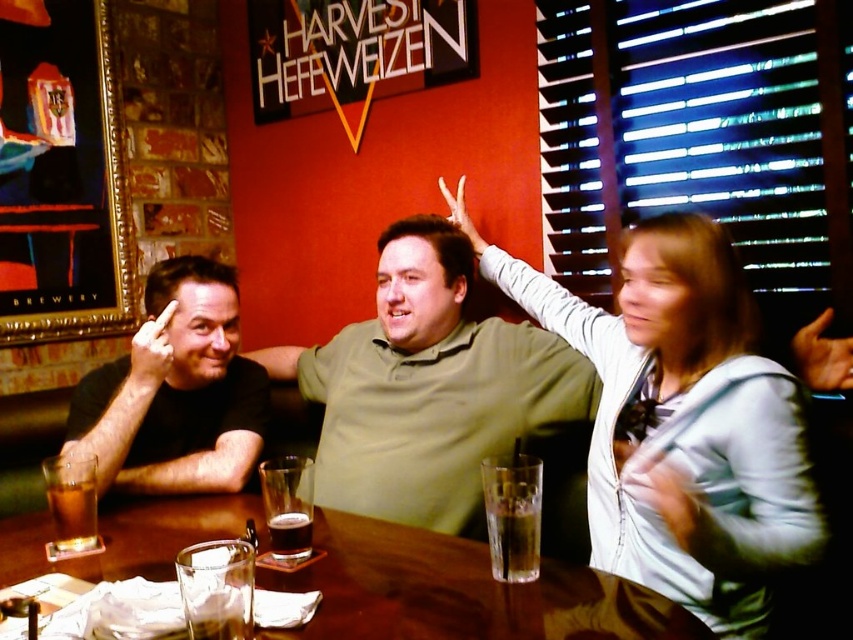
Question: Among these points, which one is nearest to the camera?

Choices:
 (A) (274, 547)
 (B) (311, 467)
 (C) (462, 177)

Answer: (A)

Question: Estimate the real-world distances between objects in this image. Which object is farther from the dark brown liquid at center?

Choices:
 (A) matte black arm at left
 (B) white fabric hand at upper right

Answer: (B)

Question: Which point is farther to the camera?

Choices:
 (A) (287, 512)
 (B) (521, 506)

Answer: (A)

Question: Does matte black arm at left have a larger size compared to dark brown liquid at center?

Choices:
 (A) yes
 (B) no

Answer: (A)

Question: Is green matte shirt at center closer to the viewer compared to matte black arm at left?

Choices:
 (A) no
 (B) yes

Answer: (A)

Question: Is black matte shirt at left wider than matte black finger at left?

Choices:
 (A) no
 (B) yes

Answer: (B)